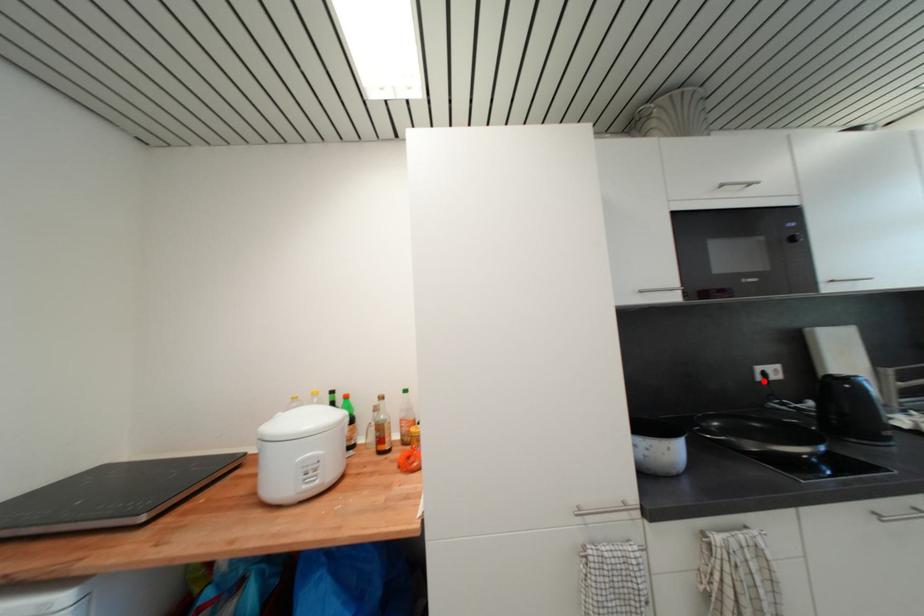
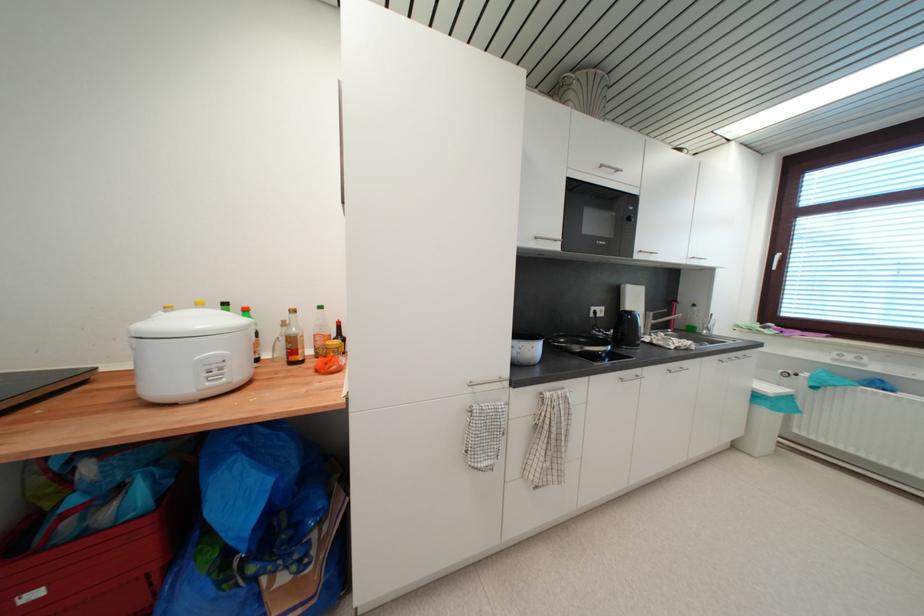
Where in the second image is the point corresponding to the highlighted location from the first image?

(597, 317)